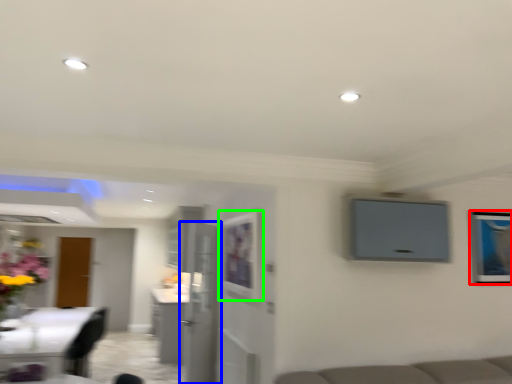
Question: Based on their relative distances, which object is nearer to picture frame (highlighted by a red box)? Choose from door (highlighted by a blue box) and picture frame (highlighted by a green box).

Choices:
 (A) door
 (B) picture frame

Answer: (B)